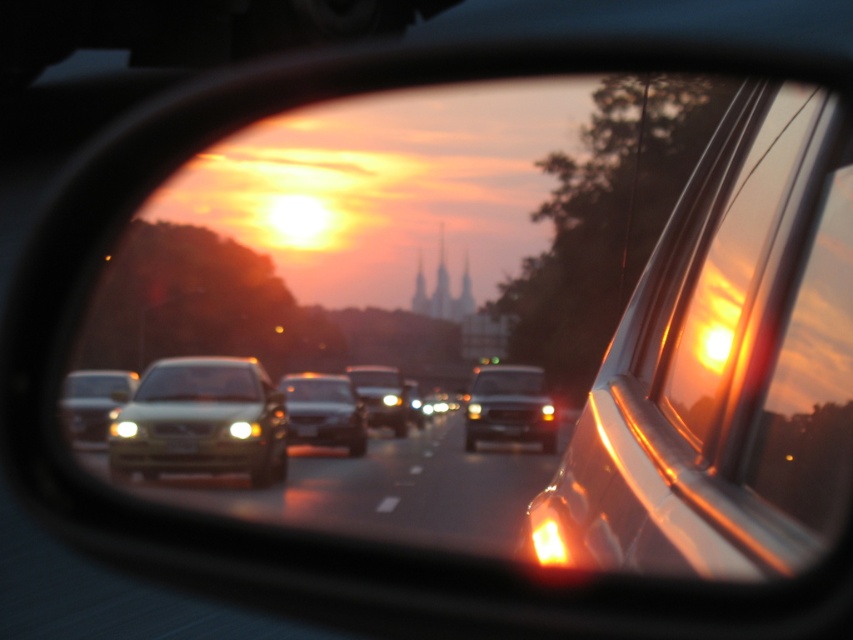
You are driving a car and looking at the side mirror reflection. You see a satin gold sedan at center and a satin black sedan at center. Which one is closer to you in the scene?

The satin gold sedan at center is closer to you because it is in front of the satin black sedan at center in the reflection.